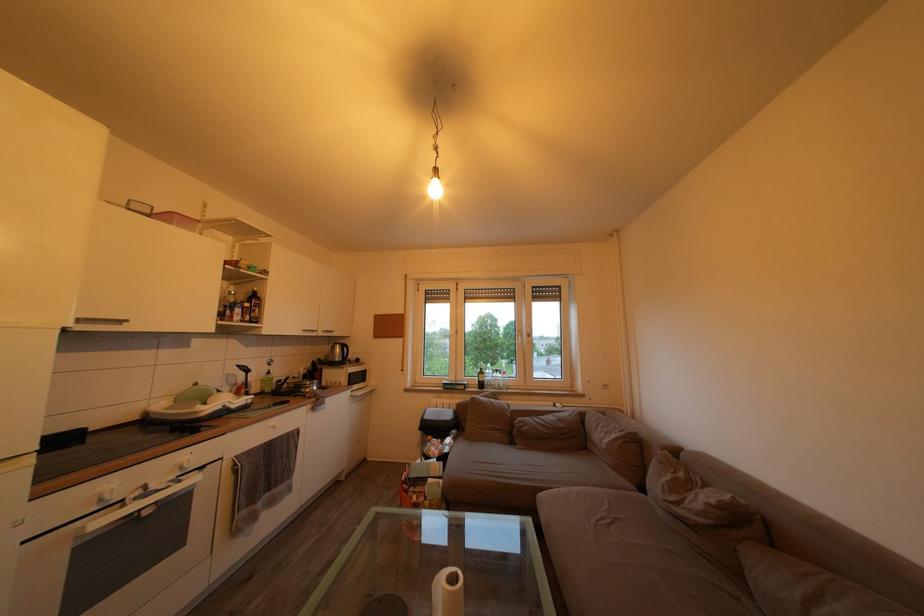
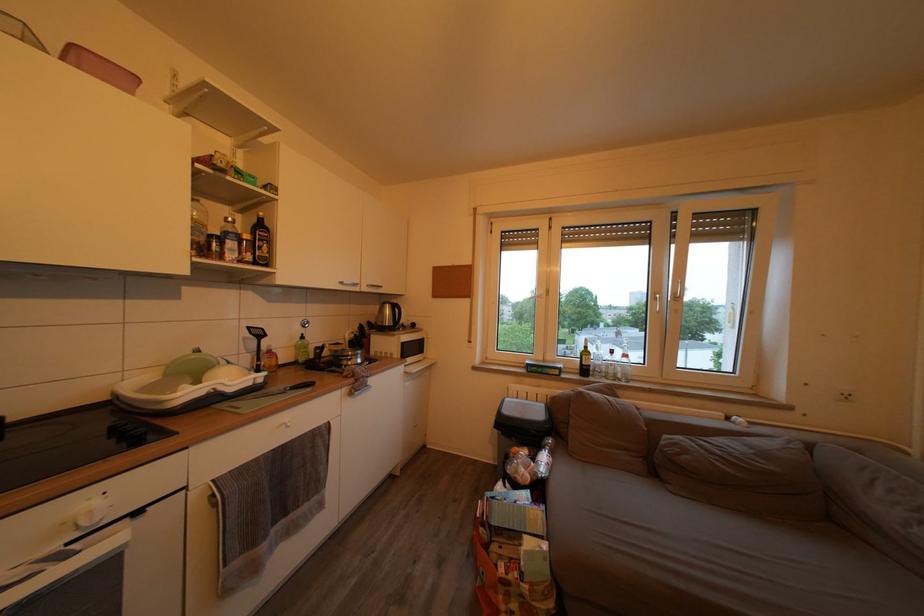
The point at [229,306] is marked in the first image. Where is the corresponding point in the second image?

(205, 230)